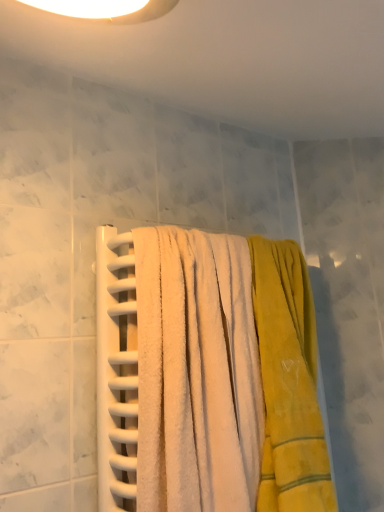
Question: Considering the positions of yellow soft towel at center, which is the second towel in left-to-right order, and white soft towel at center, the first towel viewed from the left, in the image, is yellow soft towel at center, which is the second towel in left-to-right order, bigger or smaller than white soft towel at center, the first towel viewed from the left,?

Choices:
 (A) small
 (B) big

Answer: (A)

Question: In terms of height, does yellow soft towel at center, the 1th towel in the right-to-left sequence, look taller or shorter compared to white soft towel at center, the 2th towel when ordered from right to left?

Choices:
 (A) tall
 (B) short

Answer: (A)

Question: Is yellow soft towel at center, which is the second towel in left-to-right order, wider or thinner than white soft towel at center, the 2th towel when ordered from right to left?

Choices:
 (A) wide
 (B) thin

Answer: (B)

Question: Based on their sizes in the image, would you say white soft towel at center, the 2th towel when ordered from right to left, is bigger or smaller than yellow soft towel at center, which is the second towel in left-to-right order?

Choices:
 (A) small
 (B) big

Answer: (B)

Question: Is point (147, 466) closer or farther from the camera than point (294, 410)?

Choices:
 (A) farther
 (B) closer

Answer: (B)

Question: Considering the relative positions of white soft towel at center, the 2th towel when ordered from right to left, and yellow soft towel at center, the 1th towel in the right-to-left sequence, in the image provided, is white soft towel at center, the 2th towel when ordered from right to left, to the left or to the right of yellow soft towel at center, the 1th towel in the right-to-left sequence,?

Choices:
 (A) left
 (B) right

Answer: (A)

Question: From the image's perspective, is white soft towel at center, the 2th towel when ordered from right to left, positioned above or below yellow soft towel at center, which is the second towel in left-to-right order?

Choices:
 (A) below
 (B) above

Answer: (B)